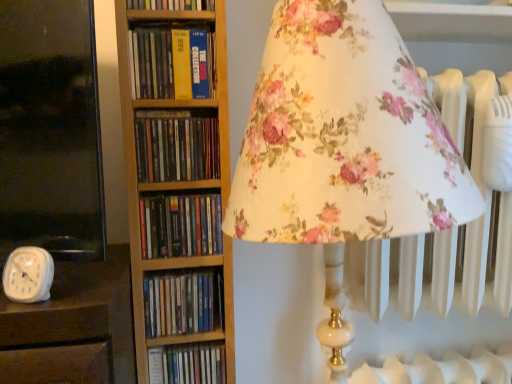
How much space does blue hardcover book at center, positioned as the 2th book in bottom-to-top order, occupy horizontally?

The width of blue hardcover book at center, positioned as the 2th book in bottom-to-top order, is 2.45 inches.

How much space does hardcover book at upper center, which is the first book in top-to-bottom order, occupy horizontally?

hardcover book at upper center, which is the first book in top-to-bottom order, is 2.46 inches wide.

What do you see at coordinates (28, 275) in the screenshot?
I see `white plastic clock at lower left` at bounding box center [28, 275].

Image resolution: width=512 pixels, height=384 pixels. What do you see at coordinates (187, 364) in the screenshot?
I see `hardcover book at center, acting as the first book starting from the bottom` at bounding box center [187, 364].

The height and width of the screenshot is (384, 512). Describe the element at coordinates (176, 146) in the screenshot. I see `hardcover books at center, the 3th book viewed from the top` at that location.

In order to click on blue hardcover book at center, which ranks as the fifth book in top-to-bottom order in this screenshot , I will do `click(183, 302)`.

Considering the sizes of blue hardcover book at center, which ranks as the fifth book in top-to-bottom order, and hardcover book at upper center, which is the 6th book in bottom-to-top order, in the image, is blue hardcover book at center, which ranks as the fifth book in top-to-bottom order, bigger or smaller than hardcover book at upper center, which is the 6th book in bottom-to-top order,?

In the image, blue hardcover book at center, which ranks as the fifth book in top-to-bottom order, appears to be smaller than hardcover book at upper center, which is the 6th book in bottom-to-top order.

From a real-world perspective, which object stands above the other?

hardcover book at upper center, which is the 6th book in bottom-to-top order.

Based on the photo, is blue hardcover book at center, which ranks as the fifth book in top-to-bottom order, situated inside hardcover book at upper center, which is the first book in top-to-bottom order, or outside?

blue hardcover book at center, which ranks as the fifth book in top-to-bottom order, is not enclosed by hardcover book at upper center, which is the first book in top-to-bottom order.

How different are the orientations of blue hardcover book at center, which ranks as the fifth book in top-to-bottom order, and hardcover book at upper center, which is the 6th book in bottom-to-top order, in degrees?

There is a 0.000349-degree angle between the facing directions of blue hardcover book at center, which ranks as the fifth book in top-to-bottom order, and hardcover book at upper center, which is the 6th book in bottom-to-top order.

How many degrees apart are the facing directions of hardcover book at center, marked as the 6th book in a top-to-bottom arrangement, and hardcover books at center, the fourth book ordered from the bottom?

There is a 0.000349-degree angle between the facing directions of hardcover book at center, marked as the 6th book in a top-to-bottom arrangement, and hardcover books at center, the fourth book ordered from the bottom.

How far apart are hardcover book at center, acting as the first book starting from the bottom, and hardcover books at center, the fourth book ordered from the bottom?

The distance of hardcover book at center, acting as the first book starting from the bottom, from hardcover books at center, the fourth book ordered from the bottom, is 16.37 inches.

Is hardcover book at center, marked as the 6th book in a top-to-bottom arrangement, next to hardcover books at center, the fourth book ordered from the bottom, and touching it?

No, hardcover book at center, marked as the 6th book in a top-to-bottom arrangement, is not touching hardcover books at center, the fourth book ordered from the bottom.

Is hardcover book at center, acting as the first book starting from the bottom, aimed at hardcover books at center, the fourth book ordered from the bottom?

No, hardcover book at center, acting as the first book starting from the bottom, is not facing towards hardcover books at center, the fourth book ordered from the bottom.

Could you measure the distance between hardcover book at center, acting as the first book starting from the bottom, and blue hardcover book at center, positioned as the 2th book in bottom-to-top order?

hardcover book at center, acting as the first book starting from the bottom, is 9.29 centimeters from blue hardcover book at center, positioned as the 2th book in bottom-to-top order.

Is hardcover book at center, acting as the first book starting from the bottom, to the left or to the right of blue hardcover book at center, which ranks as the fifth book in top-to-bottom order, in the image?

Based on their positions, hardcover book at center, acting as the first book starting from the bottom, is located to the left of blue hardcover book at center, which ranks as the fifth book in top-to-bottom order.

Locate an element on the screen. This screenshot has width=512, height=384. book behind the blue hardcover book at center, which ranks as the fifth book in top-to-bottom order is located at coordinates (187, 364).

In the scene shown: How different are the orientations of hardcover book at center, marked as the 6th book in a top-to-bottom arrangement, and blue hardcover book at center, which ranks as the fifth book in top-to-bottom order, in degrees?

0.00018 degrees separate the facing orientations of hardcover book at center, marked as the 6th book in a top-to-bottom arrangement, and blue hardcover book at center, which ranks as the fifth book in top-to-bottom order.

Is white plastic clock at lower left not close to hardcover book at center, placed as the 4th book when sorted from top to bottom?

No, white plastic clock at lower left is in close proximity to hardcover book at center, placed as the 4th book when sorted from top to bottom.

Which is nearer, (49, 293) or (197, 207)?

Point (49, 293) is positioned closer to the camera compared to point (197, 207).

Which of these two, white plastic clock at lower left or hardcover book at center, which ranks as the third book in bottom-to-top order, is wider?

Wider between the two is hardcover book at center, which ranks as the third book in bottom-to-top order.

The height and width of the screenshot is (384, 512). Find the location of `clock in front of the hardcover book at center, which ranks as the third book in bottom-to-top order`. clock in front of the hardcover book at center, which ranks as the third book in bottom-to-top order is located at coordinates (28, 275).

Looking at this image, considering the sizes of objects hardcover book at upper center, which is the first book in top-to-bottom order, and hardcover book at center, marked as the 6th book in a top-to-bottom arrangement, in the image provided, who is smaller, hardcover book at upper center, which is the first book in top-to-bottom order, or hardcover book at center, marked as the 6th book in a top-to-bottom arrangement,?

With smaller size is hardcover book at center, marked as the 6th book in a top-to-bottom arrangement.

Looking at their sizes, would you say hardcover book at upper center, which is the first book in top-to-bottom order, is wider or thinner than hardcover book at center, acting as the first book starting from the bottom?

Considering their sizes, hardcover book at upper center, which is the first book in top-to-bottom order, looks broader than hardcover book at center, acting as the first book starting from the bottom.

What's the angular difference between hardcover book at upper center, which is the 6th book in bottom-to-top order, and hardcover book at center, acting as the first book starting from the bottom,'s facing directions?

The facing directions of hardcover book at upper center, which is the 6th book in bottom-to-top order, and hardcover book at center, acting as the first book starting from the bottom, are 0.000297 degrees apart.

Is hardcover book at upper center, which is the first book in top-to-bottom order, not within hardcover book at center, acting as the first book starting from the bottom?

Absolutely, hardcover book at upper center, which is the first book in top-to-bottom order, is external to hardcover book at center, acting as the first book starting from the bottom.

Who is more distant, blue hardcover book at center, which ranks as the fifth book in top-to-bottom order, or hardcover book at center, marked as the 6th book in a top-to-bottom arrangement?

hardcover book at center, marked as the 6th book in a top-to-bottom arrangement, is more distant.

From a real-world perspective, is blue hardcover book at center, positioned as the 2th book in bottom-to-top order, over hardcover book at center, acting as the first book starting from the bottom?

Yes, from a real-world perspective, blue hardcover book at center, positioned as the 2th book in bottom-to-top order, is above hardcover book at center, acting as the first book starting from the bottom.

Can you confirm if blue hardcover book at center, which ranks as the fifth book in top-to-bottom order, is bigger than hardcover book at center, marked as the 6th book in a top-to-bottom arrangement?

Actually, blue hardcover book at center, which ranks as the fifth book in top-to-bottom order, might be smaller than hardcover book at center, marked as the 6th book in a top-to-bottom arrangement.

Are blue hardcover book at center, which ranks as the fifth book in top-to-bottom order, and hardcover book at center, marked as the 6th book in a top-to-bottom arrangement, far apart?

Actually, blue hardcover book at center, which ranks as the fifth book in top-to-bottom order, and hardcover book at center, marked as the 6th book in a top-to-bottom arrangement, are a little close together.

In the scene shown: Is white plastic clock at lower left wider than blue hardcover book at center, which ranks as the fifth book in top-to-bottom order?

No, white plastic clock at lower left is not wider than blue hardcover book at center, which ranks as the fifth book in top-to-bottom order.

Can you confirm if white plastic clock at lower left is taller than blue hardcover book at center, which ranks as the fifth book in top-to-bottom order?

Incorrect, the height of white plastic clock at lower left is not larger of that of blue hardcover book at center, which ranks as the fifth book in top-to-bottom order.

Is white plastic clock at lower left aimed at blue hardcover book at center, which ranks as the fifth book in top-to-bottom order?

No.

From the image's perspective, is white plastic clock at lower left positioned above or below blue hardcover book at center, which ranks as the fifth book in top-to-bottom order?

From the image's perspective, white plastic clock at lower left appears above blue hardcover book at center, which ranks as the fifth book in top-to-bottom order.

Identify the location of book that is the 5th one when counting rightward from the hardcover book at upper center, which is the 6th book in bottom-to-top order. This screenshot has height=384, width=512. (183, 302).

There is a hardcover books at center, the 3th book viewed from the top. At what (x,y) coordinates should I click in order to perform the action: click on the 3rd book below it (from the image's perspective). Please return your answer as a coordinate pair (x, y). The height and width of the screenshot is (384, 512). Looking at the image, I should click on (187, 364).

Considering their positions, is hardcover book at center, acting as the first book starting from the bottom, positioned closer to white plastic clock at lower left than yellow hardcover book at center, which appears as the second book when viewed from the top?

hardcover book at center, acting as the first book starting from the bottom, is positioned closer to the anchor white plastic clock at lower left.

Which object lies further to the anchor point hardcover book at upper center, which is the 6th book in bottom-to-top order, hardcover book at center, marked as the 6th book in a top-to-bottom arrangement, or hardcover books at center, the fourth book ordered from the bottom?

Based on the image, hardcover book at center, marked as the 6th book in a top-to-bottom arrangement, appears to be further to hardcover book at upper center, which is the 6th book in bottom-to-top order.

Which object lies further to the anchor point white plastic clock at lower left, blue hardcover book at center, which ranks as the fifth book in top-to-bottom order, or hardcover book at upper center, which is the first book in top-to-bottom order?

hardcover book at upper center, which is the first book in top-to-bottom order, is further to white plastic clock at lower left.

Based on their spatial positions, is hardcover book at center, marked as the 6th book in a top-to-bottom arrangement, or hardcover book at upper center, which is the 6th book in bottom-to-top order, closer to hardcover books at center, the fourth book ordered from the bottom?

hardcover book at upper center, which is the 6th book in bottom-to-top order, is positioned closer to the anchor hardcover books at center, the fourth book ordered from the bottom.

From the image, which object appears to be nearer to white plastic clock at lower left, hardcover book at center, which ranks as the third book in bottom-to-top order, or hardcover book at upper center, which is the first book in top-to-bottom order?

hardcover book at center, which ranks as the third book in bottom-to-top order, lies closer to white plastic clock at lower left than the other object.

Looking at the image, which one is located further to hardcover books at center, the 3th book viewed from the top, hardcover book at center, marked as the 6th book in a top-to-bottom arrangement, or blue hardcover book at center, which ranks as the fifth book in top-to-bottom order?

The object further to hardcover books at center, the 3th book viewed from the top, is hardcover book at center, marked as the 6th book in a top-to-bottom arrangement.

Estimate the real-world distances between objects in this image. Which object is further from hardcover books at center, the fourth book ordered from the bottom, blue hardcover book at center, which ranks as the fifth book in top-to-bottom order, or hardcover book at upper center, which is the first book in top-to-bottom order?

blue hardcover book at center, which ranks as the fifth book in top-to-bottom order, is further to hardcover books at center, the fourth book ordered from the bottom.

Which object lies nearer to the anchor point blue hardcover book at center, which ranks as the fifth book in top-to-bottom order, hardcover book at center, marked as the 6th book in a top-to-bottom arrangement, or hardcover book at upper center, which is the 6th book in bottom-to-top order?

Based on the image, hardcover book at center, marked as the 6th book in a top-to-bottom arrangement, appears to be nearer to blue hardcover book at center, which ranks as the fifth book in top-to-bottom order.

At what (x,y) coordinates should I click in order to perform the action: click on clock between hardcover book at center, placed as the 4th book when sorted from top to bottom, and hardcover book at center, marked as the 6th book in a top-to-bottom arrangement, vertically. Please return your answer as a coordinate pair (x, y). This screenshot has height=384, width=512. Looking at the image, I should click on pos(28,275).

At what (x,y) coordinates should I click in order to perform the action: click on clock between yellow hardcover book at center, positioned as the 5th book in bottom-to-top order, and blue hardcover book at center, positioned as the 2th book in bottom-to-top order, in the up-down direction. Please return your answer as a coordinate pair (x, y). Looking at the image, I should click on (28, 275).

In order to click on book that lies between hardcover book at upper center, which is the first book in top-to-bottom order, and hardcover books at center, the fourth book ordered from the bottom, from top to bottom in this screenshot , I will do 173,63.

At what (x,y) coordinates should I click in order to perform the action: click on clock between hardcover books at center, the 3th book viewed from the top, and hardcover book at center, acting as the first book starting from the bottom, in the up-down direction. Please return your answer as a coordinate pair (x, y). Looking at the image, I should click on (28, 275).